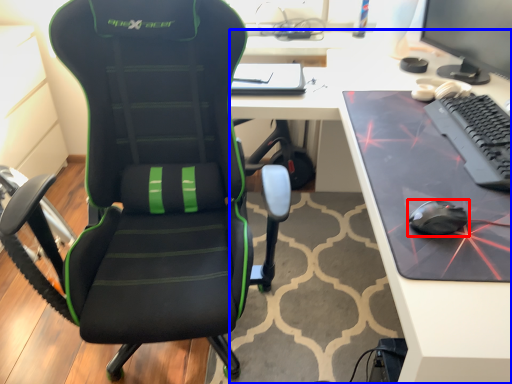
Question: Which point is closer to the camera, mouse (highlighted by a red box) or desk (highlighted by a blue box)?

Choices:
 (A) mouse
 (B) desk

Answer: (B)